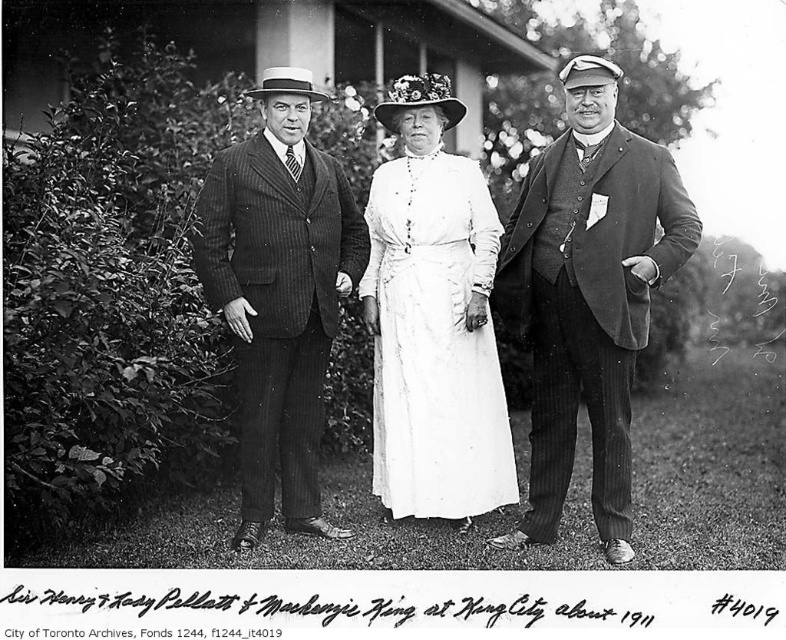
You are a photographer who wants to take a group photo of the smooth dark suit at center and the white cotton dress at center. The camera you have can only focus on subjects within 20 inches of each other. Will both subjects be in focus?

The smooth dark suit at center and the white cotton dress at center are 21.63 inches apart from each other. Since the camera requires subjects to be within 20 inches, they will not both be in focus.

From the picture: You are a photographer who wants to ensure that both the pinstriped suit at center and the white cotton dress at center are clearly visible in the photo. Based on their positions, which one is closer to the camera?

The pinstriped suit at center is in front of the white cotton dress at center, so the pinstriped suit at center is closer to the camera.

You are a photographer reviewing this black and white photo of three people in a garden. You notice two points marked in the image. The first point is at coordinates point (285, 428) and the second is at point (443, 451). Which of these two points is closer to the camera lens?

Point (285, 428) is closer to the camera lens than point (443, 451) because it is further to the viewer according to the description.